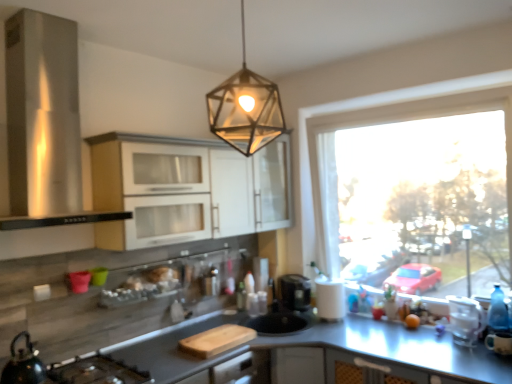
From the picture: Measure the distance between matte white cabinet at upper center, which is the 1th cabinetry from back to front, and camera.

matte white cabinet at upper center, which is the 1th cabinetry from back to front, is 2.70 meters from camera.

This screenshot has height=384, width=512. I want to click on black plastic coffee machine at center, so click(295, 292).

This screenshot has height=384, width=512. What do you see at coordinates (465, 320) in the screenshot? I see `clear plastic container at right` at bounding box center [465, 320].

At what (x,y) coordinates should I click in order to perform the action: click on transparent glass window at right. Please return your answer as a coordinate pair (x, y). Looking at the image, I should click on (383, 123).

What is the approximate height of transparent glass window at right?

It is 1.42 meters.

Find the location of a particular element. white matte paper towel at right is located at coordinates tap(330, 299).

Locate an element on the screen. The image size is (512, 384). white glossy cabinets at upper center, the second cabinetry positioned from the back is located at coordinates (194, 182).

What do you see at coordinates (321, 347) in the screenshot?
I see `metallic gray countertop at center` at bounding box center [321, 347].

Locate an element on the screen. Image resolution: width=512 pixels, height=384 pixels. matte white cabinet at upper center, which is the 1th cabinetry from back to front is located at coordinates (251, 189).

Is white glossy cabinets at upper center, marked as the 1th cabinetry in a front-to-back arrangement, further to camera compared to clear plastic container at right?

No, white glossy cabinets at upper center, marked as the 1th cabinetry in a front-to-back arrangement, is in front of clear plastic container at right.

Is white glossy cabinets at upper center, marked as the 1th cabinetry in a front-to-back arrangement, taller than clear plastic container at right?

Yes.

The width and height of the screenshot is (512, 384). In order to click on appliance behind the white glossy cabinets at upper center, the second cabinetry positioned from the back in this screenshot , I will do `click(465, 320)`.

From the image's perspective, is metallic gray countertop at center located above or below wooden cutting board at lower center?

metallic gray countertop at center is situated lower than wooden cutting board at lower center in the image.

Is wooden cutting board at lower center surrounded by metallic gray countertop at center?

No, wooden cutting board at lower center is not a part of metallic gray countertop at center.

The width and height of the screenshot is (512, 384). I want to click on cutting board that is above the metallic gray countertop at center (from the image's perspective), so click(216, 340).

Is metallic gray countertop at center to the right of wooden cutting board at lower center from the viewer's perspective?

Yes, metallic gray countertop at center is to the right of wooden cutting board at lower center.

Is clear plastic container at right far away from transparent glass window at right?

Actually, clear plastic container at right and transparent glass window at right are a little close together.

Could you tell me if clear plastic container at right is facing transparent glass window at right?

No, clear plastic container at right is not facing towards transparent glass window at right.

Based on the photo, considering the positions of objects clear plastic container at right and transparent glass window at right in the image provided, who is more to the right, clear plastic container at right or transparent glass window at right?

From the viewer's perspective, clear plastic container at right appears more on the right side.

Is white matte paper towel at right thinner than white glossy cabinets at upper center, marked as the 1th cabinetry in a front-to-back arrangement?

Yes, white matte paper towel at right is thinner than white glossy cabinets at upper center, marked as the 1th cabinetry in a front-to-back arrangement.

Which is more distant, (343, 312) or (267, 152)?

The point (267, 152) is farther.

From the picture: From a real-world perspective, between white matte paper towel at right and white glossy cabinets at upper center, the second cabinetry positioned from the back, who is vertically lower?

white matte paper towel at right.

Considering the sizes of white matte paper towel at right and white glossy cabinets at upper center, the second cabinetry positioned from the back, in the image, is white matte paper towel at right bigger or smaller than white glossy cabinets at upper center, the second cabinetry positioned from the back,?

white matte paper towel at right is smaller than white glossy cabinets at upper center, the second cabinetry positioned from the back.

Can you tell me how much transparent glass window at right and matte white cabinet at upper center, which is the 1th cabinetry from back to front, differ in facing direction?

90 degrees.

From a real-world perspective, between transparent glass window at right and matte white cabinet at upper center, positioned as the second cabinetry in front-to-back order, who is vertically higher?

matte white cabinet at upper center, positioned as the second cabinetry in front-to-back order, from a real-world perspective.

Does transparent glass window at right touch matte white cabinet at upper center, positioned as the second cabinetry in front-to-back order?

No, transparent glass window at right is not making contact with matte white cabinet at upper center, positioned as the second cabinetry in front-to-back order.

Does transparent glass window at right have a greater width compared to matte white cabinet at upper center, which is the 1th cabinetry from back to front?

In fact, transparent glass window at right might be narrower than matte white cabinet at upper center, which is the 1th cabinetry from back to front.

Is clear plastic container at right not near black matte gas stove at lower left?

clear plastic container at right is far away from black matte gas stove at lower left.

Does clear plastic container at right turn towards black matte gas stove at lower left?

No, clear plastic container at right is not aimed at black matte gas stove at lower left.

Is clear plastic container at right bigger or smaller than black matte gas stove at lower left?

Clearly, clear plastic container at right is smaller in size than black matte gas stove at lower left.

Is clear plastic container at right to the left or to the right of black matte gas stove at lower left in the image?

From the image, it's evident that clear plastic container at right is to the right of black matte gas stove at lower left.

Is wooden cutting board at lower center taller than translucent glass bottle at center?

No.

Considering the positions of objects wooden cutting board at lower center and translucent glass bottle at center in the image provided, who is behind, wooden cutting board at lower center or translucent glass bottle at center?

Positioned behind is translucent glass bottle at center.

Does wooden cutting board at lower center have a lesser width compared to translucent glass bottle at center?

No.

Is wooden cutting board at lower center turned away from translucent glass bottle at center?

That's not correct — wooden cutting board at lower center is not looking away from translucent glass bottle at center.

At what (x,y) coordinates should I click in order to perform the action: click on appliance located on the right of white glossy cabinets at upper center, the second cabinetry positioned from the back. Please return your answer as a coordinate pair (x, y). This screenshot has width=512, height=384. Looking at the image, I should click on (465, 320).

The height and width of the screenshot is (384, 512). Find the location of `countertop in front of the wooden cutting board at lower center`. countertop in front of the wooden cutting board at lower center is located at coordinates (321, 347).

Based on their spatial positions, is shiny black kettle at lower left or metallic hexagonal light fixture at upper center further from black plastic coffee machine at center?

Based on the image, metallic hexagonal light fixture at upper center appears to be further to black plastic coffee machine at center.

From the image, which object appears to be nearer to white matte paper towel at right, translucent glass bottle at center or matte white cabinet at upper center, positioned as the second cabinetry in front-to-back order?

Among the two, translucent glass bottle at center is located nearer to white matte paper towel at right.

Considering their positions, is shiny black kettle at lower left positioned further to clear plastic container at right than black matte gas stove at lower left?

shiny black kettle at lower left is positioned further to the anchor clear plastic container at right.

Estimate the real-world distances between objects in this image. Which object is closer to clear plastic container at right, metallic gray countertop at center or wooden cutting board at lower center?

metallic gray countertop at center.

From the image, which object appears to be farther from matte white cabinet at upper center, positioned as the second cabinetry in front-to-back order, black matte gas stove at lower left or metallic hexagonal light fixture at upper center?

black matte gas stove at lower left.

Looking at the image, which one is located further to white glossy cabinets at upper center, the second cabinetry positioned from the back, matte white cabinet at upper center, which is the 1th cabinetry from back to front, or stainless steel range hood at left?

stainless steel range hood at left is further to white glossy cabinets at upper center, the second cabinetry positioned from the back.

Looking at the image, which one is located further to white matte paper towel at right, metallic hexagonal light fixture at upper center or clear plastic container at right?

The object further to white matte paper towel at right is metallic hexagonal light fixture at upper center.

From the image, which object appears to be nearer to clear plastic container at right, wooden cutting board at lower center or metallic gray countertop at center?

Based on the image, metallic gray countertop at center appears to be nearer to clear plastic container at right.

Identify the location of paper towel between white glossy cabinets at upper center, the second cabinetry positioned from the back, and transparent glass window at right, in the horizontal direction. (330, 299).

Locate an element on the screen. coffee machine between black matte gas stove at lower left and clear plastic container at right in the horizontal direction is located at coordinates (295, 292).

Locate an element on the screen. cutting board positioned between shiny black kettle at lower left and translucent glass bottle at center from near to far is located at coordinates (216, 340).

At what (x,y) coordinates should I click in order to perform the action: click on gas stove located between stainless steel range hood at left and clear plastic container at right in the left-right direction. Please return your answer as a coordinate pair (x, y). Looking at the image, I should click on (96, 372).